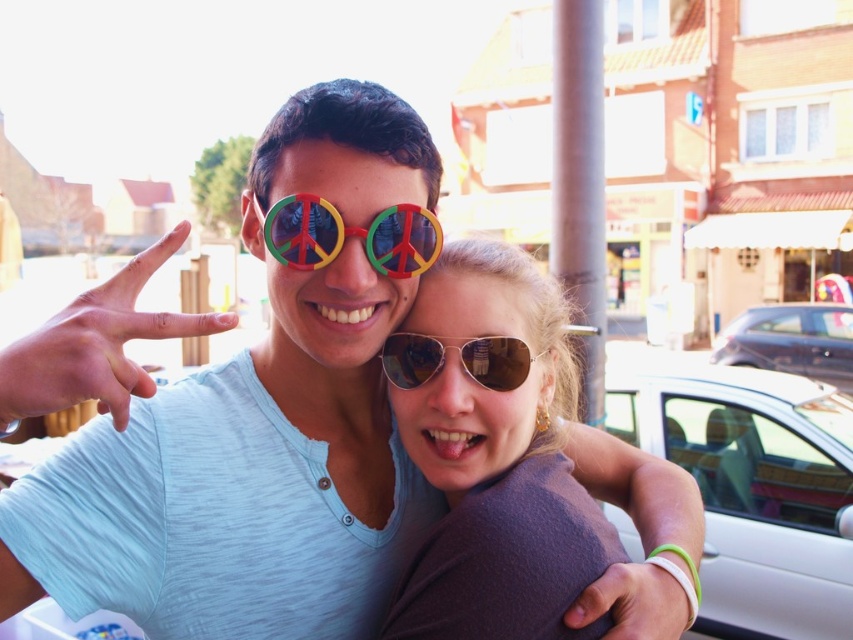
Is multicolored plastic goggles at center positioned at the back of gold reflective aviator sunglasses at center?

No, multicolored plastic goggles at center is closer to the viewer.

Is multicolored plastic goggles at center bigger than gold reflective aviator sunglasses at center?

Yes.

Is point (387, 250) farther from camera compared to point (399, 362)?

No, it is in front of (399, 362).

You are a GUI agent. You are given a task and a screenshot of the screen. Output one action in this format:
    pyautogui.click(x=<x>, y=<y>)
    Task: Click on the multicolored plastic goggles at center
    
    Given the screenshot: What is the action you would take?
    pyautogui.click(x=350, y=236)

Between point (270, 227) and point (817, 333), which one is positioned in front?

Point (270, 227) is more forward.

In the scene shown: Who is higher up, multicolored plastic goggles at center or metallic blue car at right?

multicolored plastic goggles at center is above.

Who is more distant from viewer, (x=372, y=220) or (x=849, y=307)?

Point (x=849, y=307)

Locate an element on the screen. multicolored plastic goggles at center is located at coordinates (350, 236).

Who is lower down, white matte car at right or gold reflective aviator sunglasses at center?

white matte car at right is below.

Is white matte car at right positioned at the back of gold reflective aviator sunglasses at center?

Yes, white matte car at right is further from the viewer.

Between point (791, 397) and point (428, 380), which one is positioned in front?

Point (428, 380) is in front.

The height and width of the screenshot is (640, 853). Identify the location of white matte car at right. (750, 484).